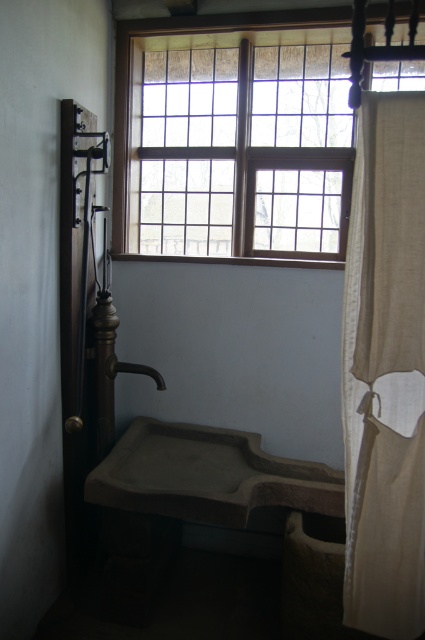
Who is lower down, wooden frame at upper center or matte stone sink at lower left?

matte stone sink at lower left

Does wooden frame at upper center appear on the right side of matte stone sink at lower left?

Yes, wooden frame at upper center is to the right of matte stone sink at lower left.

Who is more distant from viewer, (121, 36) or (161, 506)?

The point (121, 36) is behind.

Locate an element on the screen. Image resolution: width=425 pixels, height=640 pixels. wooden frame at upper center is located at coordinates (234, 134).

Which is behind, point (363, 140) or point (136, 472)?

The point (136, 472) is more distant.

Does point (376, 113) lie behind point (183, 429)?

That is False.

Where is `beige fabric curtain at right`? The height and width of the screenshot is (640, 425). beige fabric curtain at right is located at coordinates (385, 369).

Between wooden frame at upper center and matte brown faucet at lower center, which one appears on the left side from the viewer's perspective?

From the viewer's perspective, matte brown faucet at lower center appears more on the left side.

Between point (192, 241) and point (139, 365), which one is positioned in front?

Point (139, 365) is more forward.

The image size is (425, 640). In order to click on wooden frame at upper center in this screenshot , I will do `click(234, 134)`.

In order to click on wooden frame at upper center in this screenshot , I will do `click(234, 134)`.